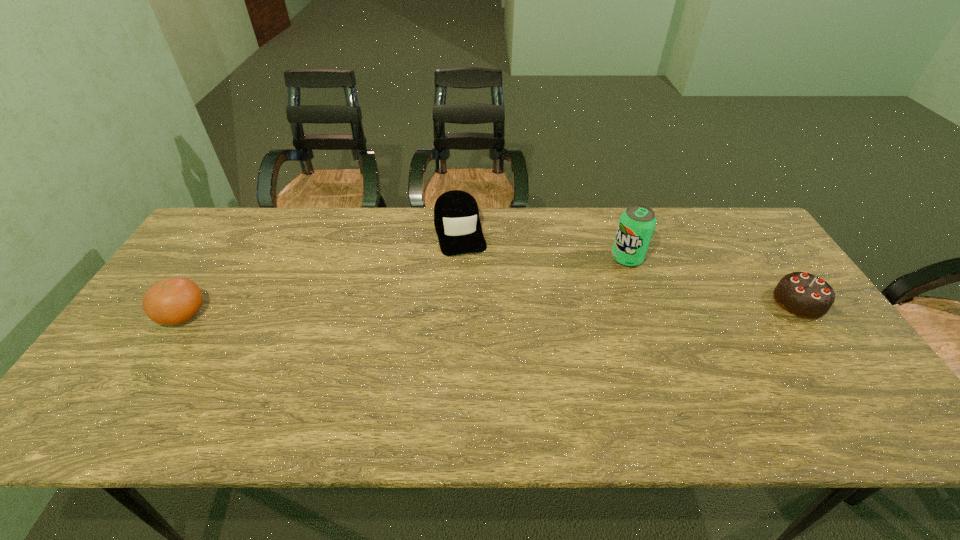
Point out which object is positioned as the nearest to the cap. Please provide its 2D coordinates. Your answer should be formatted as a tuple, i.e. [(x, y)], where the tuple contains the x and y coordinates of a point satisfying the conditions above.

[(637, 223)]

Locate which object ranks in proximity to the chocolate cake. Please provide its 2D coordinates. Your answer should be formatted as a tuple, i.e. [(x, y)], where the tuple contains the x and y coordinates of a point satisfying the conditions above.

[(637, 223)]

Image resolution: width=960 pixels, height=540 pixels. In order to click on vacant position in the image that satisfies the following two spatial constraints: 1. on the front side of the pop soda; 2. on the left side of the chocolate cake in this screenshot , I will do `click(642, 302)`.

Locate an element on the screen. This screenshot has width=960, height=540. free space that satisfies the following two spatial constraints: 1. on the front side of the pop soda; 2. on the left side of the rightmost object is located at coordinates (642, 302).

At what (x,y) coordinates should I click in order to perform the action: click on free space that satisfies the following two spatial constraints: 1. on the back side of the pop soda; 2. on the right side of the leftmost object. Please return your answer as a coordinate pair (x, y). Image resolution: width=960 pixels, height=540 pixels. Looking at the image, I should click on (219, 258).